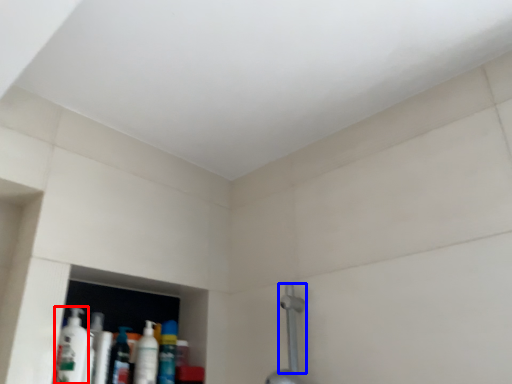
Question: Among these objects, which one is nearest to the camera, mouthwash (highlighted by a red box) or shower (highlighted by a blue box)?

Choices:
 (A) mouthwash
 (B) shower

Answer: (A)